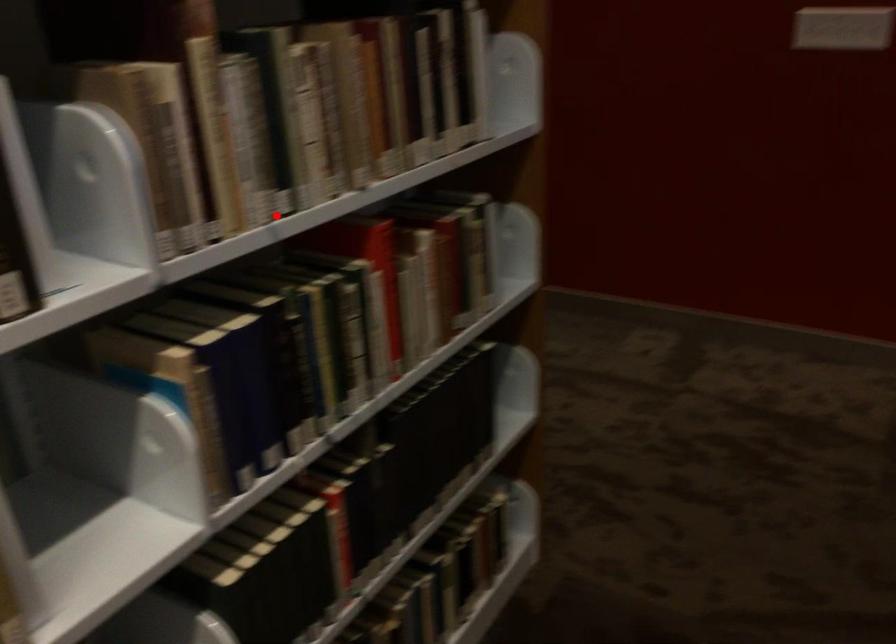
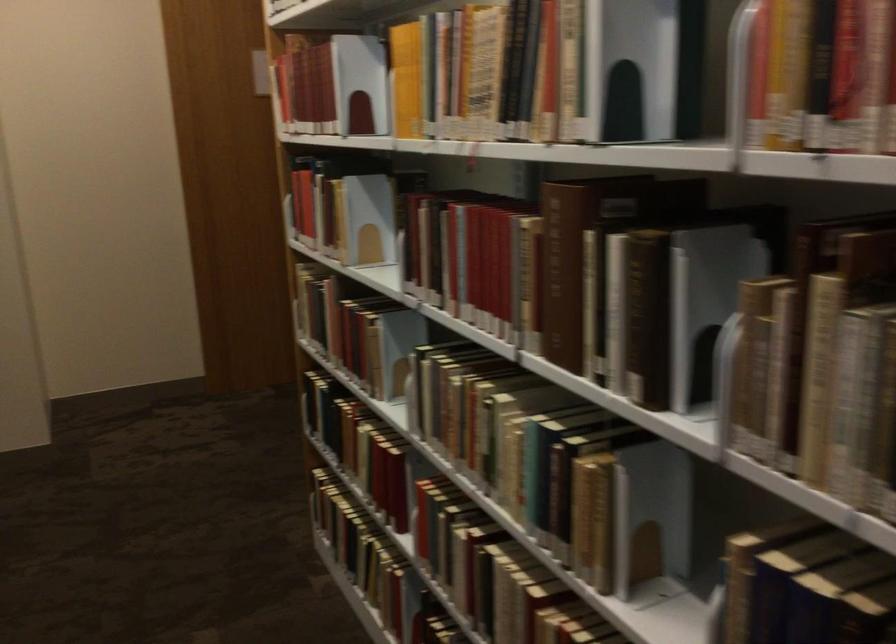
Question: I am providing you with two images of the same scene from different viewpoints. Image1 has a red point marked. In image2, the corresponding 3D location appears at what relative position? Reply with the corresponding letter.

Choices:
 (A) Closer
 (B) Farther

Answer: (A)